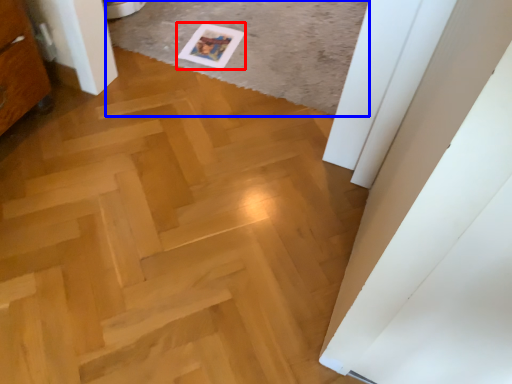
Question: Which object is closer to the camera taking this photo, postcard (highlighted by a red box) or plain (highlighted by a blue box)?

Choices:
 (A) postcard
 (B) plain

Answer: (B)